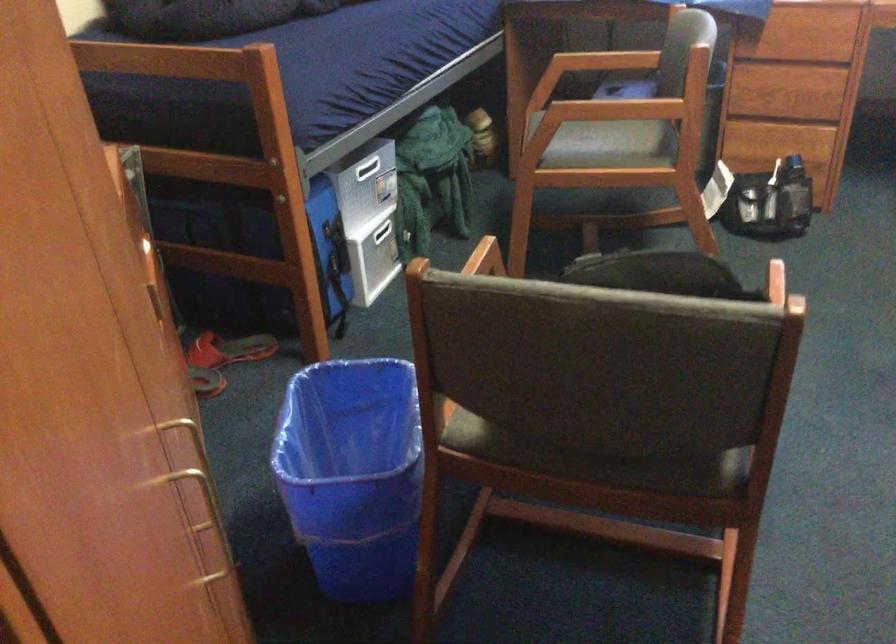
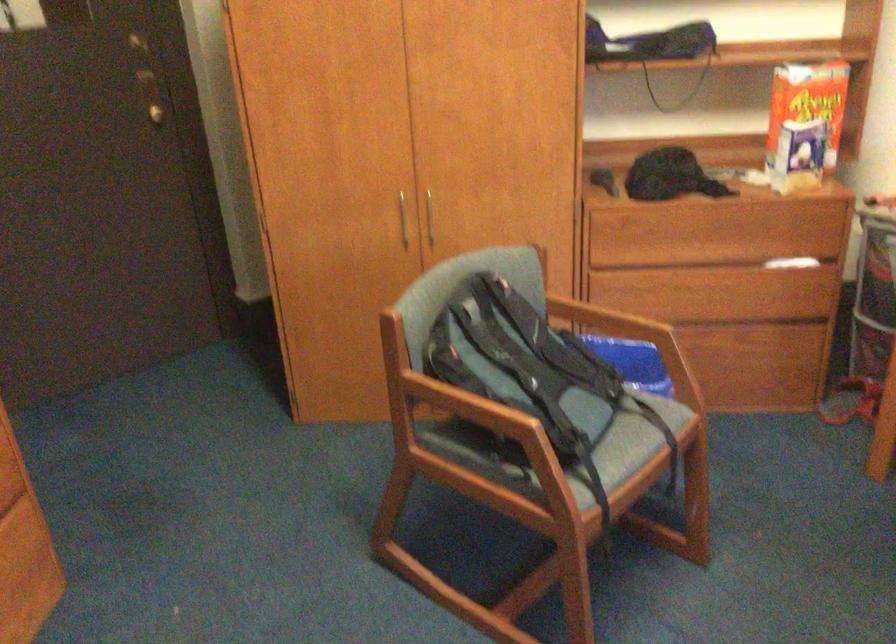
Question: I am providing you with two images of the same scene from different viewpoints. After the viewpoint changes to image2, which objects are now occluded?

Choices:
 (A) chair sitting surface
 (B) orange cereal box
 (C) wrapped cylindrical object
 (D) blue trash can

Answer: (D)